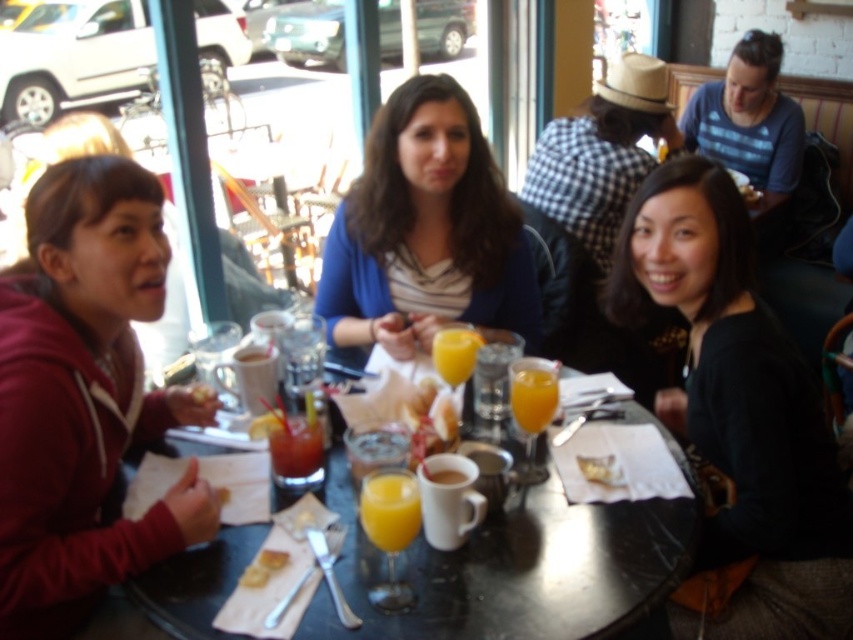
Is maroon hoodie at left bigger than matte brown bread at table center?

Yes.

Does maroon hoodie at left have a greater width compared to matte brown bread at table center?

Correct, the width of maroon hoodie at left exceeds that of matte brown bread at table center.

Between point (74, 403) and point (204, 387), which one is positioned in front?

Point (74, 403) is in front.

The height and width of the screenshot is (640, 853). Find the location of `maroon hoodie at left`. maroon hoodie at left is located at coordinates (83, 396).

Can you confirm if blue cardigan at center is wider than white matte mug at center?

Yes, blue cardigan at center is wider than white matte mug at center.

Is point (457, 260) positioned behind point (270, 346)?

Yes, it is behind point (270, 346).

Which is in front, point (408, 333) or point (270, 371)?

Point (270, 371)

The image size is (853, 640). I want to click on blue cardigan at center, so click(425, 230).

Is orange translucent glass at center to the right of matte brown bread at table center from the viewer's perspective?

Yes, orange translucent glass at center is to the right of matte brown bread at table center.

Which is in front, point (515, 419) or point (196, 392)?

Point (515, 419) is more forward.

Identify the location of orange translucent glass at center. click(x=532, y=397).